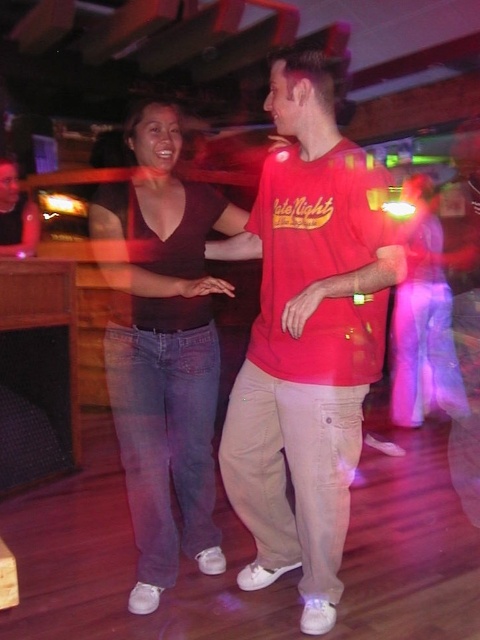
Between point (340, 365) and point (152, 180), which one is positioned behind?

The point (152, 180) is behind.

Is matte red t-shirt at center to the right of matte black tank top at center from the viewer's perspective?

Yes, matte red t-shirt at center is to the right of matte black tank top at center.

Where is `matte red t-shirt at center`? This screenshot has width=480, height=640. matte red t-shirt at center is located at coordinates (305, 340).

At what (x,y) coordinates should I click in order to perform the action: click on matte red t-shirt at center. Please return your answer as a coordinate pair (x, y). This screenshot has width=480, height=640. Looking at the image, I should click on (305, 340).